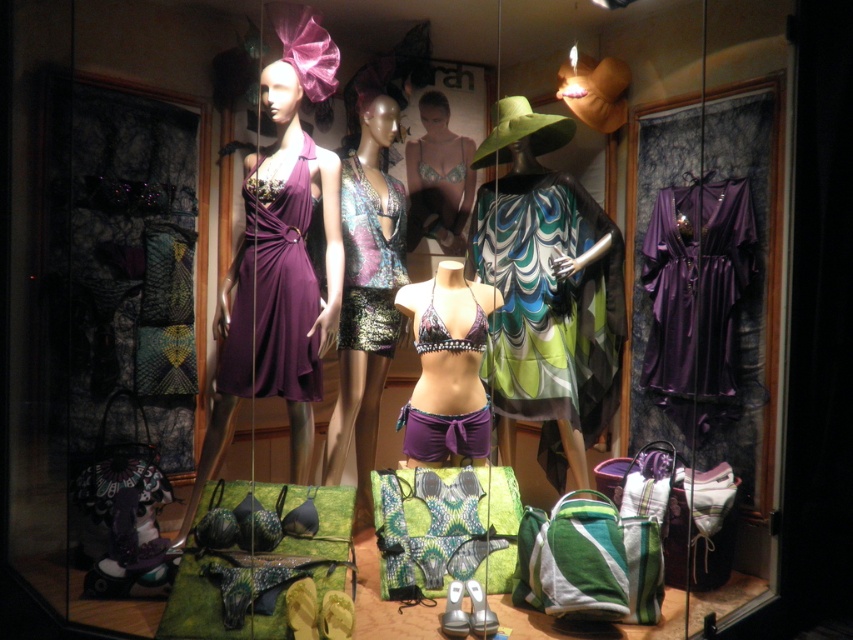
Question: Based on their relative distances, which object is nearer to the matte silver bra at center?

Choices:
 (A) satin purple dress at right
 (B) matte purple dress at center
 (C) metallic sequined dress at center

Answer: (C)

Question: Considering the real-world distances, which object is farthest from the purple fabric bikini top at center?

Choices:
 (A) green textured dress at center
 (B) printed fabric bikini top at center
 (C) matte silver bra at center
 (D) matte black bikini at center

Answer: (D)

Question: Where is matte purple dress at center located in relation to matte black bikini at center in the image?

Choices:
 (A) left
 (B) right

Answer: (A)

Question: From the image, what is the correct spatial relationship of satin purple dress at right in relation to printed fabric bikini top at center?

Choices:
 (A) right
 (B) left

Answer: (A)

Question: Considering the real-world distances, which object is farthest from the metallic sequined dress at center?

Choices:
 (A) printed fabric bikini top at center
 (B) purple fabric bikini top at center
 (C) matte silver bra at center

Answer: (A)

Question: Is matte silver bra at center to the left of matte black bikini at center from the viewer's perspective?

Choices:
 (A) no
 (B) yes

Answer: (B)